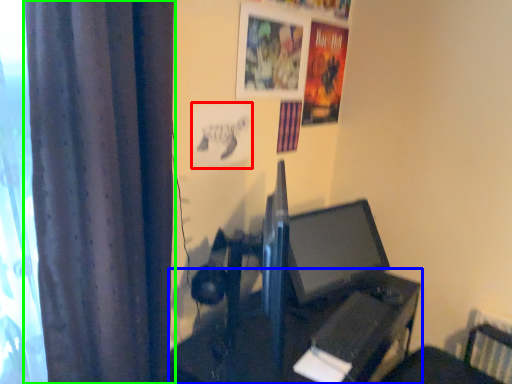
Question: Considering the real-world distances, which object is closest to poster page (highlighted by a red box)? table (highlighted by a blue box) or curtain (highlighted by a green box).

Choices:
 (A) table
 (B) curtain

Answer: (B)